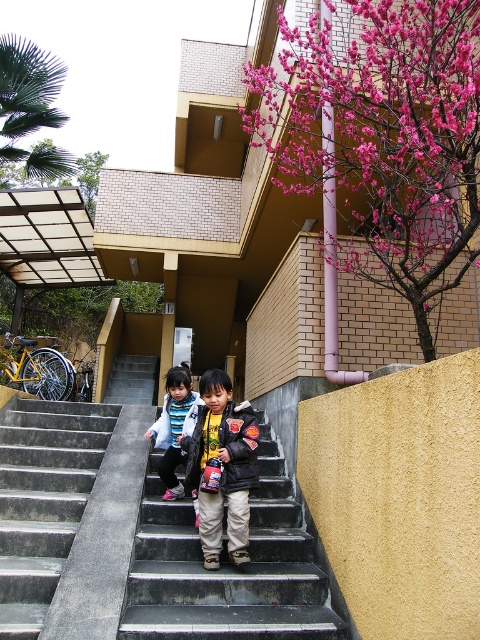
Question: Where is black leather jacket at center located in relation to striped fleece jacket at center in the image?

Choices:
 (A) left
 (B) right

Answer: (B)

Question: Estimate the real-world distances between objects in this image. Which object is farther from the striped fleece jacket at center?

Choices:
 (A) gray concrete stairs at center
 (B) black leather jacket at center
 (C) concrete stairs at center

Answer: (A)

Question: Is black concrete stairs at center below striped fleece jacket at center?

Choices:
 (A) no
 (B) yes

Answer: (B)

Question: Considering the relative positions of black concrete stairs at center and concrete stairs at center in the image provided, where is black concrete stairs at center located with respect to concrete stairs at center?

Choices:
 (A) above
 (B) below

Answer: (B)

Question: Which object is the farthest from the gray concrete stairs at center?

Choices:
 (A) black leather jacket at center
 (B) concrete stairs at center

Answer: (A)

Question: Which point appears closest to the camera in this image?

Choices:
 (A) (242, 486)
 (B) (182, 365)

Answer: (A)